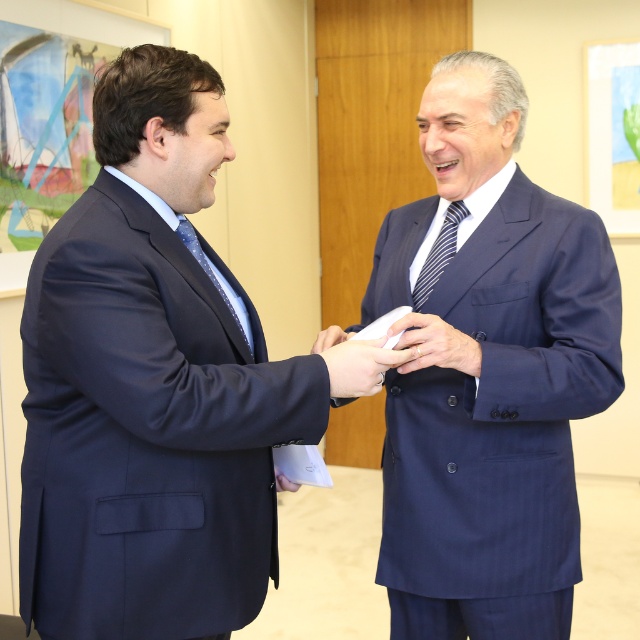
Based on the photo, you are an event planner organizing a formal event and need to arrange the seating based on the ties. The shiny blue tie at left and the striped fabric tie at center are both part of the guest attire. Which tie is positioned closer to the front of the room?

The striped fabric tie at center is closer to the front of the room because the shiny blue tie at left is behind it.

You are a security guard standing in the office. You need to check the ID card of the person wearing the matte blue suit at left. Can you reach them within 2 meters without moving?

The distance between the matte blue suit at left and the viewer is 1.18 meters, so yes, you can reach them within 2 meters without moving.

You are a photographer setting up for a formal event. You need to ensure that the white paper at center and the shiny blue tie at left are both visible in the frame. Based on their positions, which object is closer to the camera?

The shiny blue tie at left is closer to the camera because the white paper at center is positioned under it, indicating it is behind the tie.